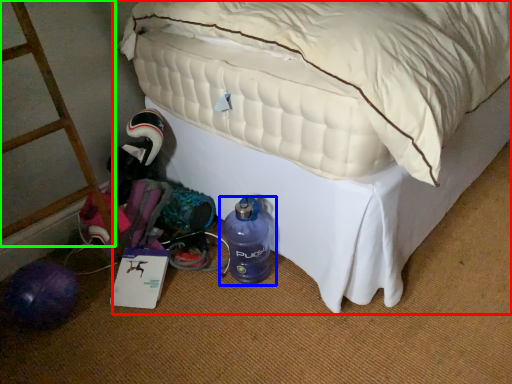
Question: Based on their relative distances, which object is farther from bed (highlighted by a red box)? Choose from bottle (highlighted by a blue box) and ladder (highlighted by a green box).

Choices:
 (A) bottle
 (B) ladder

Answer: (B)